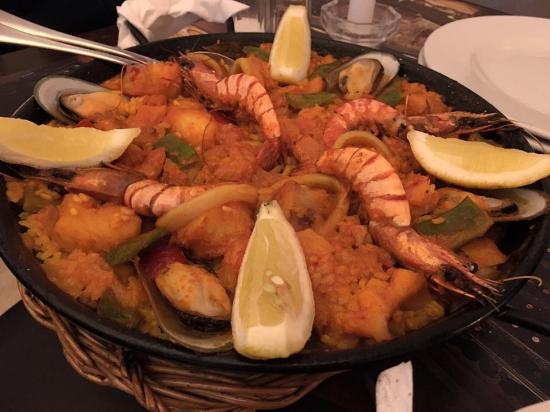
Identify the location of basket. The width and height of the screenshot is (550, 412). (240, 389).